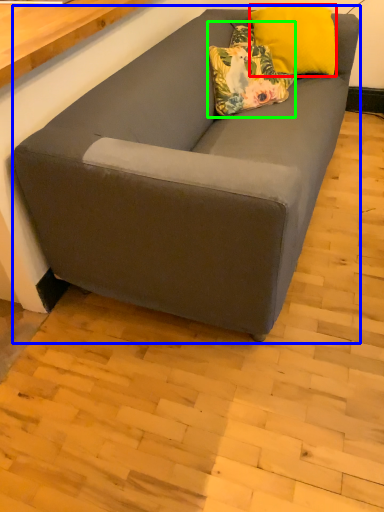
Question: Considering the real-world distances, which object is closest to pillow (highlighted by a red box)? studio couch (highlighted by a blue box) or pillow (highlighted by a green box).

Choices:
 (A) studio couch
 (B) pillow

Answer: (B)